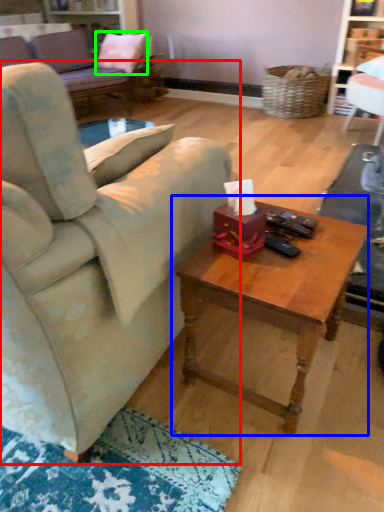
Question: Which object is the closest to the studio couch (highlighted by a red box)? Choose among these: coffee table (highlighted by a blue box) or pillow (highlighted by a green box).

Choices:
 (A) coffee table
 (B) pillow

Answer: (A)